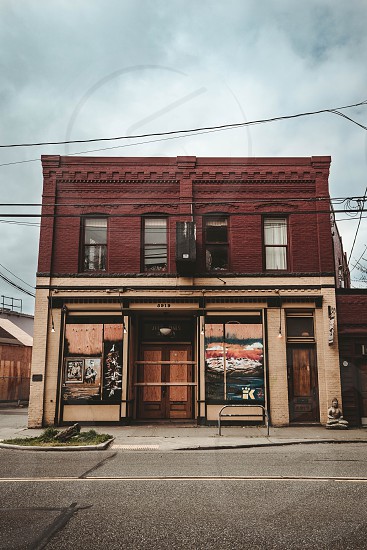
At what (x,y) coordinates should I click in order to perform the action: click on boarded up doors. Please return your answer as a coordinate pair (x, y). Image resolution: width=367 pixels, height=550 pixels. Looking at the image, I should click on (149, 368), (173, 370), (302, 373).